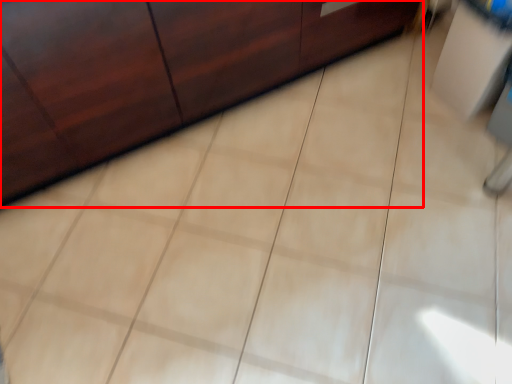
Question: From the image's perspective, considering the relative positions of furniture (annotated by the red box) and vanity in the image provided, where is furniture (annotated by the red box) located with respect to the staircase?

Choices:
 (A) below
 (B) above

Answer: (B)